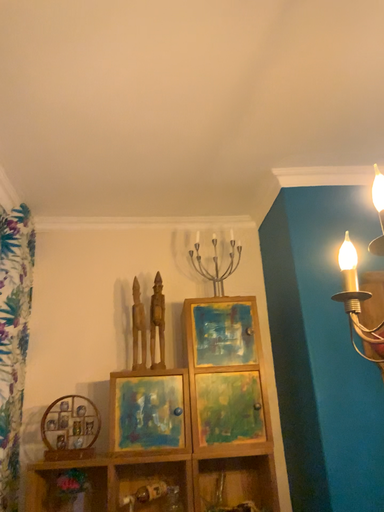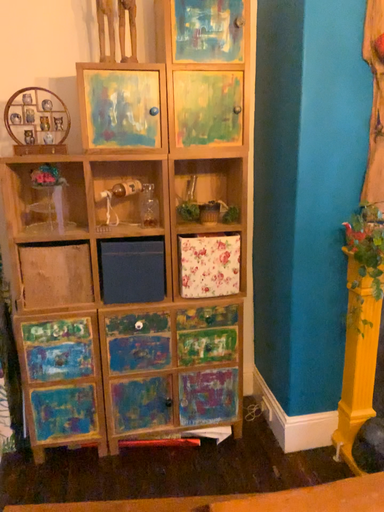
Question: Which way did the camera rotate in the video?

Choices:
 (A) rotated downward
 (B) rotated upward

Answer: (A)